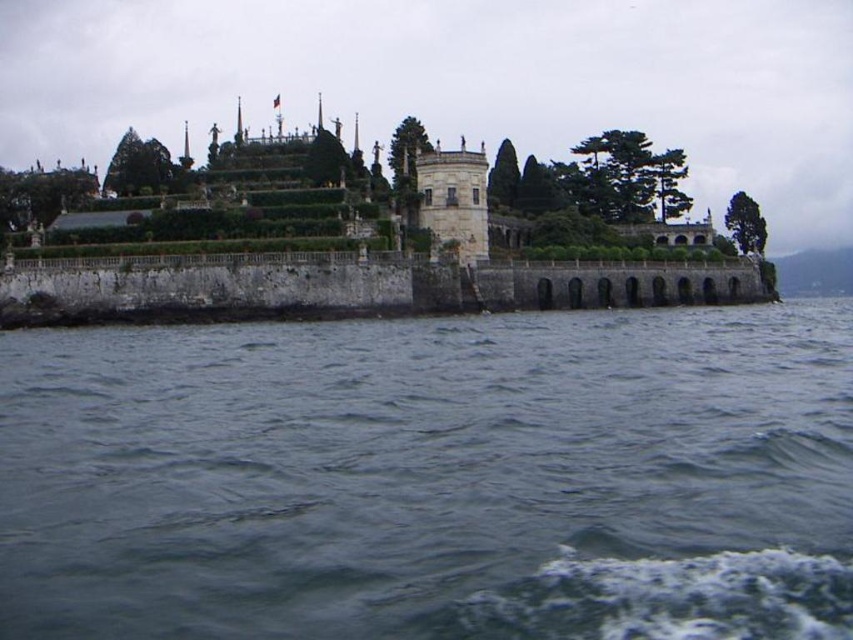
You are standing on the island looking towards the grand historic structure. There is a point marked at coordinates [41,193]. Which object does this point lie on?

The point at coordinates [41,193] lies on the green leafy tree at upper left.

You are standing on the island looking at the grand historic structure. There are two points marked on the image, one at coordinates point (659, 216) and another at point (79, 196). Which point is closer to you?

Point (79, 196) is closer to you because it is less further to the camera than point (659, 216).

You are a visitor standing at the edge of the island looking towards the historic building. You notice the gray water at lower left and the green leafy tree at center. Which of these two elements occupies a larger area in the scene?

The gray water at lower left is bigger than the green leafy tree at center, so the gray water at lower left occupies a larger area in the scene.